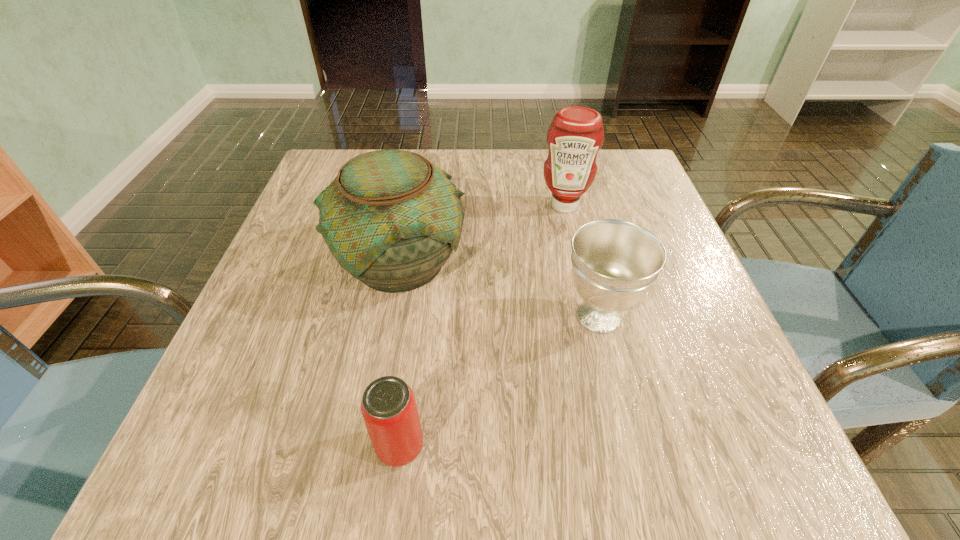
The image size is (960, 540). I want to click on free space at the far right corner, so click(x=629, y=172).

At what (x,y) coordinates should I click in order to perform the action: click on free space at the near right corner of the desktop. Please return your answer as a coordinate pair (x, y). Looking at the image, I should click on (685, 468).

Locate an element on the screen. vacant space that is in between the beer can and the chalice is located at coordinates (499, 381).

This screenshot has height=540, width=960. In order to click on vacant area that lies between the nearest object and the pottery in this screenshot , I will do `click(400, 353)`.

Identify the location of free space between the farthest object and the shortest object. The width and height of the screenshot is (960, 540). (482, 326).

This screenshot has width=960, height=540. In order to click on free space between the chalice and the shortest object in this screenshot , I will do `click(499, 381)`.

Where is `free spot between the pottery and the condiment`? The width and height of the screenshot is (960, 540). free spot between the pottery and the condiment is located at coordinates (483, 233).

You are a GUI agent. You are given a task and a screenshot of the screen. Output one action in this format:
    pyautogui.click(x=<x>, y=<y>)
    Task: Click on the empty space that is in between the shortest object and the farthest object
    
    Given the screenshot: What is the action you would take?
    pyautogui.click(x=482, y=326)

Locate an element on the screen. This screenshot has height=540, width=960. blank region between the shortest object and the second shortest object is located at coordinates (499, 381).

Identify which object is the nearest to the nearest object. Please provide its 2D coordinates. Your answer should be formatted as a tuple, i.e. [(x, y)], where the tuple contains the x and y coordinates of a point satisfying the conditions above.

[(391, 219)]